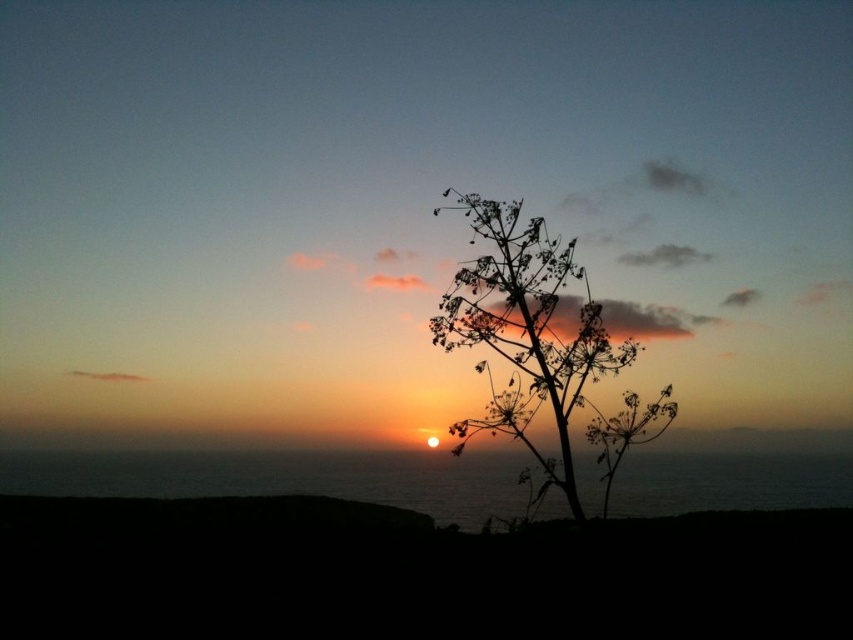
Question: Does transparent water at lower center appear on the right side of silhouette wood at center?

Choices:
 (A) yes
 (B) no

Answer: (B)

Question: Which point appears closest to the camera in this image?

Choices:
 (A) 532,268
 (B) 723,465

Answer: (A)

Question: Which point is farther from the camera taking this photo?

Choices:
 (A) (764, 474)
 (B) (569, 468)

Answer: (A)

Question: Does transparent water at lower center appear over silhouette wood at center?

Choices:
 (A) no
 (B) yes

Answer: (A)

Question: Is the position of transparent water at lower center more distant than that of silhouette wood at center?

Choices:
 (A) yes
 (B) no

Answer: (A)

Question: Which of the following is the farthest from the observer?

Choices:
 (A) silhouette wood at center
 (B) transparent water at lower center

Answer: (B)